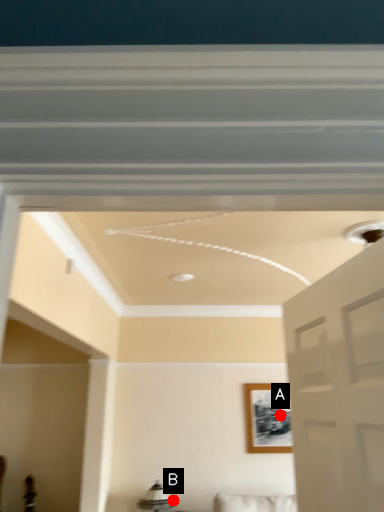
Question: Two points are circled on the image, labeled by A and B beside each circle. Which point is further to the camera?

Choices:
 (A) A is further
 (B) B is further

Answer: (A)